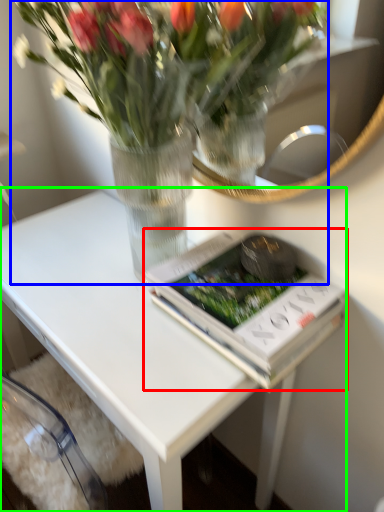
Question: Considering the real-world distances, which object is closest to paperback book (highlighted by a red box)? houseplant (highlighted by a blue box) or table (highlighted by a green box).

Choices:
 (A) houseplant
 (B) table

Answer: (B)